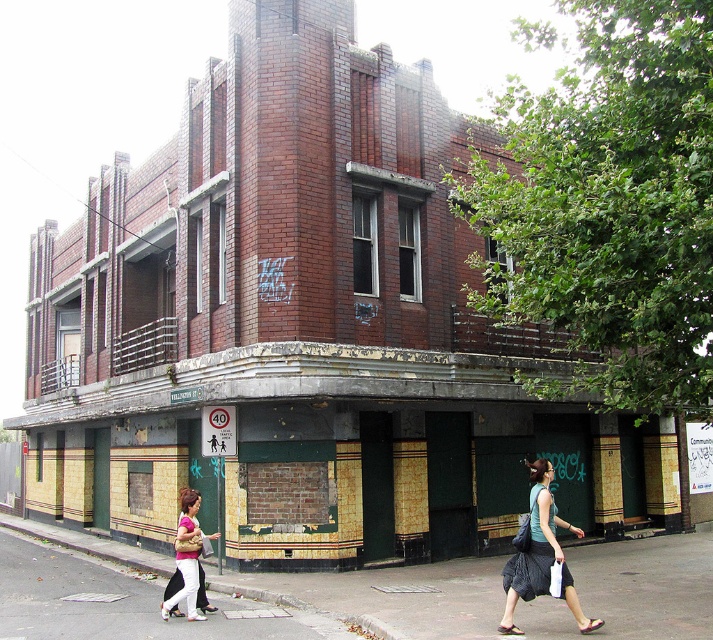
You are standing in front of the three story brick building and see a green fabric bag at lower right and a matte pink shirt at lower center. Which object is nearer to you?

The green fabric bag at lower right is closer to the viewer than the matte pink shirt at lower center.

You are standing in front of the building and want to throw a ball to hit the point at coordinates (573, 593). If your maximum throwing distance is 8 meters, will you be able to reach it?

The point at coordinates (573, 593) is 8.52 meters away from the viewer, which exceeds your maximum throwing distance of 8 meters. Therefore, you won

You are standing in front of the three story brick building. You notice two points marked on the building. The first point is at coordinate point (369, 392) and the second point is at coordinate point (530, 580). Which point is closer to you?

Point (369, 392) is closer to you because it is further to the viewer than point (530, 580).